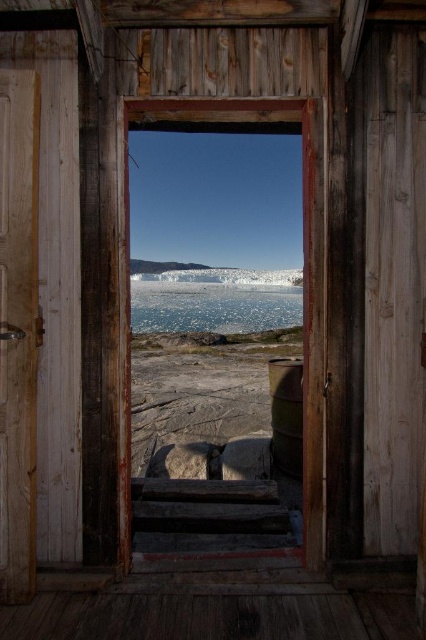
Is transparent glass window at center thinner than rusty wooden stairs at center?

Indeed, transparent glass window at center has a lesser width compared to rusty wooden stairs at center.

Is transparent glass window at center bigger than rusty wooden stairs at center?

No, transparent glass window at center is not bigger than rusty wooden stairs at center.

Where is `transparent glass window at center`? The image size is (426, 640). transparent glass window at center is located at coordinates (304, 262).

Which of these two, rusty wooden stairs at center or translucent ice at center, stands taller?

Standing taller between the two is translucent ice at center.

Is rusty wooden stairs at center smaller than translucent ice at center?

Yes.

At what (x,y) coordinates should I click in order to perform the action: click on rusty wooden stairs at center. Please return your answer as a coordinate pair (x, y). The height and width of the screenshot is (640, 426). Looking at the image, I should click on (210, 516).

What do you see at coordinates (304, 262) in the screenshot?
I see `transparent glass window at center` at bounding box center [304, 262].

Which is in front, point (304, 252) or point (157, 326)?

Point (304, 252) is in front.

Between point (305, 196) and point (281, 292), which one is positioned in front?

Positioned in front is point (305, 196).

Where is `transparent glass window at center`? Image resolution: width=426 pixels, height=640 pixels. transparent glass window at center is located at coordinates pyautogui.click(x=304, y=262).